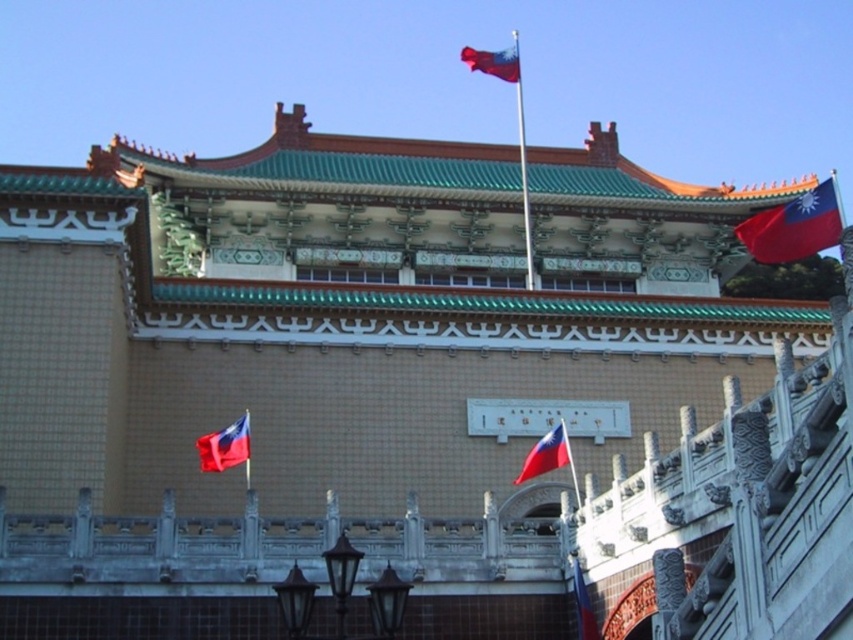
Question: Among these objects, which one is nearest to the camera?

Choices:
 (A) red fabric flag at center
 (B) polished metal flag pole at center
 (C) red fabric flag at upper center
 (D) red fabric flag at upper right

Answer: (A)

Question: Is red fabric flag at center to the right of red fabric flag at upper center from the viewer's perspective?

Choices:
 (A) yes
 (B) no

Answer: (B)

Question: Which point is closer to the camera?

Choices:
 (A) red fabric flag at upper right
 (B) polished metal flag pole at center
 (C) red fabric flag at center

Answer: (C)

Question: Can you confirm if matte red flag at center is bigger than polished metal flag pole at center?

Choices:
 (A) no
 (B) yes

Answer: (A)

Question: Considering the real-world distances, which object is closest to the polished metal flag pole at center?

Choices:
 (A) matte red flag at center
 (B) red fabric flag at upper center
 (C) red fabric flag at center

Answer: (B)

Question: Can you confirm if polished metal flag pole at center is bigger than red fabric flag at upper center?

Choices:
 (A) no
 (B) yes

Answer: (B)